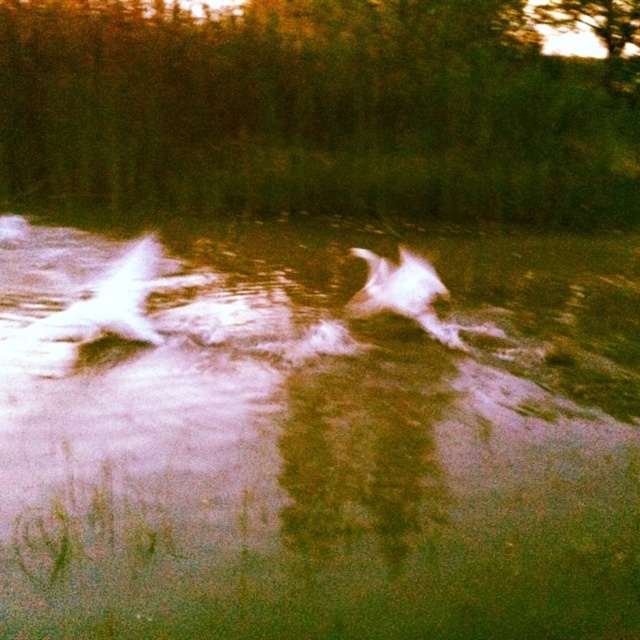
You are a photographer trying to capture the white fluffy dog at center in the image. The white frothy water at center is obstructing the view. Can you adjust your camera angle to focus on the dog without the water covering it?

The white frothy water at center is larger in size than the white fluffy dog at center, so adjusting the camera angle might be challenging. However, tilting the camera slightly downward or moving to a position where the dog is framed above the water could help isolate the dog from the splashes.

You are a photographer trying to capture the white fluffy dog at center and the white frothy water at center in a single shot. Based on their positions, which one will appear closer to the camera?

The white frothy water at center appears closer to the camera because it is taller than the white fluffy dog at center, indicating it is in a more forward position in the scene.

You are a photographer trying to capture the white fluffy dog at center jumping over the white frothy water at center. Based on their positions, can you determine if the dog is jumping into the water or out of it?

The white frothy water at center is located below the white fluffy dog at center, which indicates that the dog is jumping out of the water.